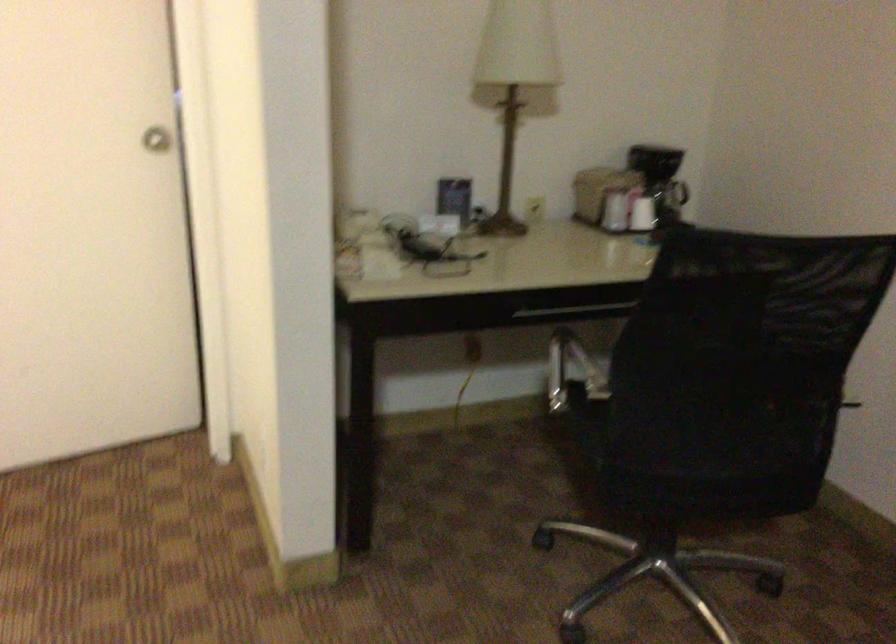
Where would you pull the silver door knob? Please return your answer as a coordinate pair (x, y).

(156, 138)